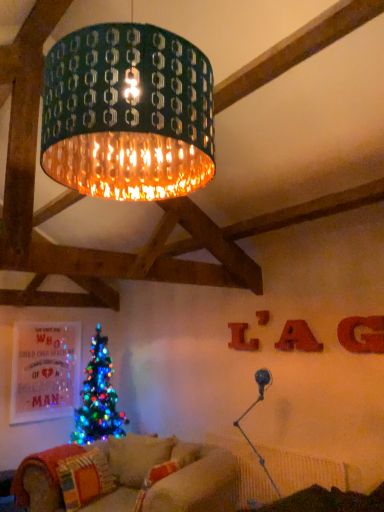
What are the coordinates of `matte red letter at upper right, the 4th letter in the front-to-back sequence` in the screenshot? It's located at (241, 338).

What do you see at coordinates (249, 411) in the screenshot?
I see `metallic silver table lamp at lower right` at bounding box center [249, 411].

Find the location of `red felt letter g at upper right, which is counted as the first letter, starting from the right`. red felt letter g at upper right, which is counted as the first letter, starting from the right is located at coordinates (362, 334).

This screenshot has width=384, height=512. In order to click on green textured lampshade at upper center in this screenshot , I will do `click(127, 113)`.

The width and height of the screenshot is (384, 512). What do you see at coordinates (263, 317) in the screenshot?
I see `wooden letter at center right, the third letter in the front-to-back sequence` at bounding box center [263, 317].

Locate an element on the screen. white textured pillow at lower center, which is the 1th pillow from right to left is located at coordinates (137, 457).

From a real-world perspective, between red felt letter g at upper right, which appears as the first letter when viewed from the front, and wooden letter at center right, positioned as the third letter in right-to-left order, who is vertically lower?

From a 3D spatial view, red felt letter g at upper right, which appears as the first letter when viewed from the front, is below.

Based on their sizes in the image, would you say red felt letter g at upper right, which appears as the fourth letter when viewed from the left, is bigger or smaller than wooden letter at center right, marked as the second letter in a back-to-front arrangement?

Considering their sizes, red felt letter g at upper right, which appears as the fourth letter when viewed from the left, takes up more space than wooden letter at center right, marked as the second letter in a back-to-front arrangement.

In the image, is red felt letter g at upper right, which appears as the fourth letter when viewed from the left, positioned in front of or behind wooden letter at center right, positioned as the third letter in right-to-left order?

In the image, red felt letter g at upper right, which appears as the fourth letter when viewed from the left, appears in front of wooden letter at center right, positioned as the third letter in right-to-left order.

Is red felt letter g at upper right, which appears as the fourth letter when viewed from the left, not inside wooden letter at center right, marked as the second letter in a back-to-front arrangement?

Yes, red felt letter g at upper right, which appears as the fourth letter when viewed from the left, is not within wooden letter at center right, marked as the second letter in a back-to-front arrangement.

Does wooden letter at center right, marked as the second letter in a back-to-front arrangement, come in front of metallic silver table lamp at lower right?

No.

Is wooden letter at center right, marked as the second letter in a back-to-front arrangement, completely or partially outside of metallic silver table lamp at lower right?

Yes, wooden letter at center right, marked as the second letter in a back-to-front arrangement, is not within metallic silver table lamp at lower right.

In terms of height, does wooden letter at center right, acting as the 2th letter starting from the left, look taller or shorter compared to metallic silver table lamp at lower right?

Clearly, wooden letter at center right, acting as the 2th letter starting from the left, is shorter compared to metallic silver table lamp at lower right.

Is wooden letter at center right, positioned as the third letter in right-to-left order, looking in the opposite direction of metallic silver table lamp at lower right?

No, wooden letter at center right, positioned as the third letter in right-to-left order, is not facing the opposite direction of metallic silver table lamp at lower right.

From the picture: Can you tell me how much metallic silver table lamp at lower right and green textured lampshade at upper center differ in facing direction?

The facing directions of metallic silver table lamp at lower right and green textured lampshade at upper center are 1.84 degrees apart.

From the image's perspective, is metallic silver table lamp at lower right above green textured lampshade at upper center?

Incorrect, from the image's perspective, metallic silver table lamp at lower right is lower than green textured lampshade at upper center.

Does metallic silver table lamp at lower right have a greater height compared to green textured lampshade at upper center?

No.

Is point (256, 506) less distant than point (170, 140)?

No, it is behind (170, 140).

Is wooden letter at center right, acting as the 2th letter starting from the left, turned away from matte red letter at upper right, which is the second letter in front-to-back order?

No.

Is wooden letter at center right, the third letter in the front-to-back sequence, further to the viewer compared to matte red letter at upper right, marked as the 2th letter in a right-to-left arrangement?

Yes, wooden letter at center right, the third letter in the front-to-back sequence, is further from the viewer.

From a real-world perspective, is wooden letter at center right, marked as the second letter in a back-to-front arrangement, above or below matte red letter at upper right, marked as the 2th letter in a right-to-left arrangement?

wooden letter at center right, marked as the second letter in a back-to-front arrangement, is above matte red letter at upper right, marked as the 2th letter in a right-to-left arrangement.

Is wooden letter at center right, the third letter in the front-to-back sequence, completely or partially outside of matte red letter at upper right, the 3th letter when ordered from left to right?

wooden letter at center right, the third letter in the front-to-back sequence, is positioned outside matte red letter at upper right, the 3th letter when ordered from left to right.

Does point (345, 344) come farther from viewer compared to point (109, 475)?

No, it is in front of (109, 475).

Based on the photo, how different are the orientations of red felt letter g at upper right, which appears as the first letter when viewed from the front, and multicolored fabric pillow at lower left, which appears as the 2th pillow when viewed from the right, in degrees?

The facing directions of red felt letter g at upper right, which appears as the first letter when viewed from the front, and multicolored fabric pillow at lower left, which appears as the 2th pillow when viewed from the right, are 101 degrees apart.

Which of these two, red felt letter g at upper right, positioned as the fourth letter in back-to-front order, or multicolored fabric pillow at lower left, which appears as the 2th pillow when viewed from the right, stands taller?

Standing taller between the two is multicolored fabric pillow at lower left, which appears as the 2th pillow when viewed from the right.

There is a multicolored fabric pillow at lower left, which appears as the 2th pillow when viewed from the right. Find the location of `the 1st letter above it (from a real-world perspective)`. the 1st letter above it (from a real-world perspective) is located at coordinates (362, 334).

Is matte red letter at upper right, the third letter in the back-to-front sequence, facing towards green textured lampshade at upper center?

No, matte red letter at upper right, the third letter in the back-to-front sequence, is not turned towards green textured lampshade at upper center.

Considering the sizes of matte red letter at upper right, marked as the 2th letter in a right-to-left arrangement, and green textured lampshade at upper center in the image, is matte red letter at upper right, marked as the 2th letter in a right-to-left arrangement, wider or thinner than green textured lampshade at upper center?

Considering their sizes, matte red letter at upper right, marked as the 2th letter in a right-to-left arrangement, looks slimmer than green textured lampshade at upper center.

From a real-world perspective, which object rests below the other?

matte red letter at upper right, marked as the 2th letter in a right-to-left arrangement, from a real-world perspective.

Is matte red letter at upper right, which is the second letter in front-to-back order, closer to the viewer compared to green textured lampshade at upper center?

No, the depth of matte red letter at upper right, which is the second letter in front-to-back order, is greater than that of green textured lampshade at upper center.

Can you see white textured pillow at lower center, which is the second pillow from left to right, touching metallic silver table lamp at lower right?

No, white textured pillow at lower center, which is the second pillow from left to right, is not making contact with metallic silver table lamp at lower right.

Considering the relative sizes of white textured pillow at lower center, which is the 1th pillow from right to left, and metallic silver table lamp at lower right in the image provided, is white textured pillow at lower center, which is the 1th pillow from right to left, shorter than metallic silver table lamp at lower right?

Yes.

From the image's perspective, between white textured pillow at lower center, which is the second pillow from left to right, and metallic silver table lamp at lower right, which one is located above?

metallic silver table lamp at lower right is shown above in the image.

Is point (116, 478) closer or farther from the camera than point (255, 372)?

Point (116, 478).

Identify the location of the 3rd letter above the red felt letter g at upper right, which is counted as the first letter, starting from the right (from a real-world perspective). This screenshot has width=384, height=512. [x=263, y=317].

Identify the location of table lamp beneath the wooden letter at center right, acting as the 2th letter starting from the left (from a real-world perspective). coord(249,411).

Looking at the image, which one is located further to metallic silver table lamp at lower right, red felt letter g at upper right, positioned as the fourth letter in back-to-front order, or matte red letter at upper right, marked as the 1th letter in a back-to-front arrangement?

red felt letter g at upper right, positioned as the fourth letter in back-to-front order.

Based on their spatial positions, is matte red letter at upper right, the 4th letter in the front-to-back sequence, or matte red letter at upper right, the 3th letter when ordered from left to right, closer to red felt letter g at upper right, which appears as the first letter when viewed from the front?

Among the two, matte red letter at upper right, the 3th letter when ordered from left to right, is located nearer to red felt letter g at upper right, which appears as the first letter when viewed from the front.

Which object lies further to the anchor point white textured pillow at lower center, which is the second pillow from left to right, matte red letter at upper right, positioned as the 1th letter in left-to-right order, or red felt letter g at upper right, which is counted as the first letter, starting from the right?

red felt letter g at upper right, which is counted as the first letter, starting from the right, lies further to white textured pillow at lower center, which is the second pillow from left to right, than the other object.

When comparing their distances from wooden letter at center right, positioned as the third letter in right-to-left order, does green textured lampshade at upper center or matte red letter at upper right, which is the second letter in front-to-back order, seem further?

Among the two, green textured lampshade at upper center is located further to wooden letter at center right, positioned as the third letter in right-to-left order.

Considering their positions, is metallic silver table lamp at lower right positioned further to white textured pillow at lower center, which is the 1th pillow from right to left, than green textured lampshade at upper center?

green textured lampshade at upper center is further to white textured pillow at lower center, which is the 1th pillow from right to left.

From the image, which object appears to be farther from multicolored fabric pillow at lower left, which appears as the 2th pillow when viewed from the right, red felt letter g at upper right, which appears as the first letter when viewed from the front, or wooden letter at center right, the third letter in the front-to-back sequence?

red felt letter g at upper right, which appears as the first letter when viewed from the front, lies further to multicolored fabric pillow at lower left, which appears as the 2th pillow when viewed from the right, than the other object.

Which object lies further to the anchor point metallic silver table lamp at lower right, matte red letter at upper right, marked as the 2th letter in a right-to-left arrangement, or wooden letter at center right, acting as the 2th letter starting from the left?

wooden letter at center right, acting as the 2th letter starting from the left, lies further to metallic silver table lamp at lower right than the other object.

Which object lies nearer to the anchor point red felt letter g at upper right, which appears as the fourth letter when viewed from the left, matte red letter at upper right, the 3th letter when ordered from left to right, or wooden letter at center right, positioned as the third letter in right-to-left order?

The object closer to red felt letter g at upper right, which appears as the fourth letter when viewed from the left, is matte red letter at upper right, the 3th letter when ordered from left to right.

This screenshot has width=384, height=512. In order to click on table lamp between green textured lampshade at upper center and multicolored fabric pillow at lower left, which appears as the 2th pillow when viewed from the right, in the up-down direction in this screenshot , I will do `click(249, 411)`.

You are a GUI agent. You are given a task and a screenshot of the screen. Output one action in this format:
    pyautogui.click(x=<x>, y=<y>)
    Task: Click on the letter between green textured lampshade at upper center and matte red letter at upper right, the 3th letter when ordered from left to right, along the z-axis
    The image size is (384, 512).
    Given the screenshot: What is the action you would take?
    pyautogui.click(x=362, y=334)

The image size is (384, 512). Identify the location of letter positioned between matte red letter at upper right, the 3th letter when ordered from left to right, and matte red letter at upper right, which is the fourth letter from right to left, from near to far. (263, 317).

The image size is (384, 512). Identify the location of letter between red felt letter g at upper right, positioned as the fourth letter in back-to-front order, and wooden letter at center right, positioned as the third letter in right-to-left order, from front to back. (298, 338).